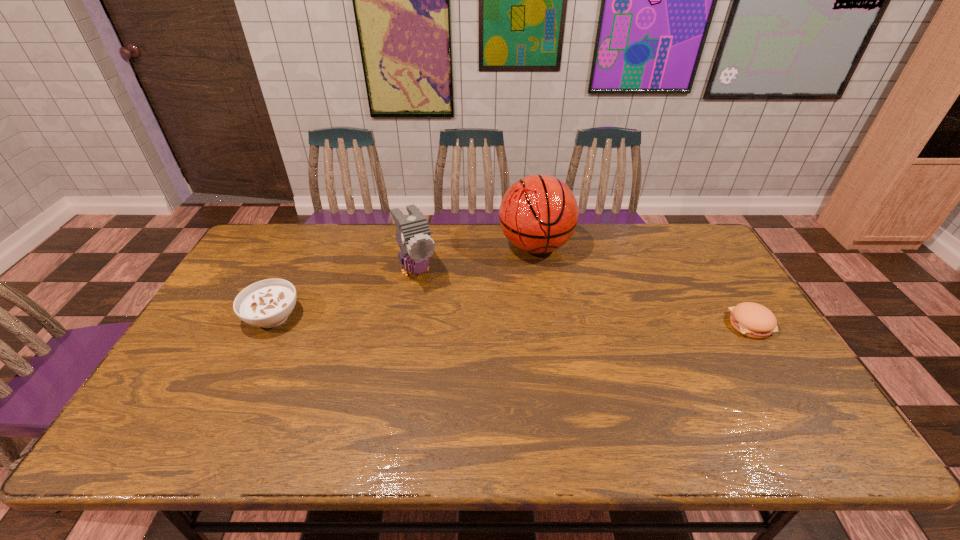
The width and height of the screenshot is (960, 540). In order to click on vacant space at the far edge of the desktop in this screenshot , I will do `click(575, 240)`.

Where is `free space at the near edge`? The image size is (960, 540). free space at the near edge is located at coordinates (477, 395).

Locate an element on the screen. blank space at the left edge of the desktop is located at coordinates (228, 303).

Locate an element on the screen. free space at the right edge of the desktop is located at coordinates (732, 306).

In the image, there is a desktop. At what (x,y) coordinates should I click in order to perform the action: click on vacant area at the far left corner. Please return your answer as a coordinate pair (x, y). Image resolution: width=960 pixels, height=540 pixels. Looking at the image, I should click on (291, 248).

I want to click on vacant space at the near right corner of the desktop, so click(x=765, y=404).

Locate an element on the screen. unoccupied position between the shortest object and the tallest object is located at coordinates (643, 285).

At what (x,y) coordinates should I click in order to perform the action: click on empty space between the second shortest object and the patty. Please return your answer as a coordinate pair (x, y). Looking at the image, I should click on (512, 321).

Find the location of a particular element. This screenshot has height=540, width=960. unoccupied position between the soup bowl and the third object from right to left is located at coordinates (345, 293).

The height and width of the screenshot is (540, 960). In order to click on empty space between the shortest object and the bird in this screenshot , I will do `click(584, 297)`.